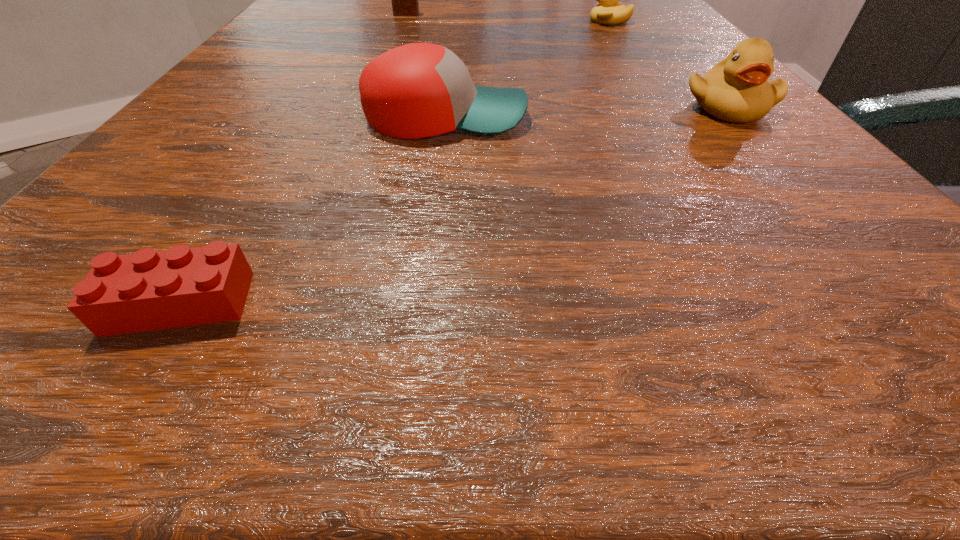
Locate an element on the screen. padlock is located at coordinates (405, 0).

This screenshot has width=960, height=540. I want to click on the nearer duckling, so click(737, 90).

Locate an element on the screen. This screenshot has height=540, width=960. baseball cap is located at coordinates (418, 90).

The width and height of the screenshot is (960, 540). What are the coordinates of `the farther duckling` in the screenshot? It's located at (610, 11).

Find the location of a particular element. the second shortest object is located at coordinates (610, 11).

Identify the location of the leftmost object. The height and width of the screenshot is (540, 960). (149, 290).

Where is `the shortest object`? The image size is (960, 540). the shortest object is located at coordinates (149, 290).

In order to click on vacant space located on the front-facing side of the padlock in this screenshot , I will do `click(396, 40)`.

What are the coordinates of `vacant space positioned on the front-facing side of the taller duckling` in the screenshot? It's located at (913, 324).

Find the location of a particular element. vacant space situated at the brim of the baseball cap is located at coordinates (660, 117).